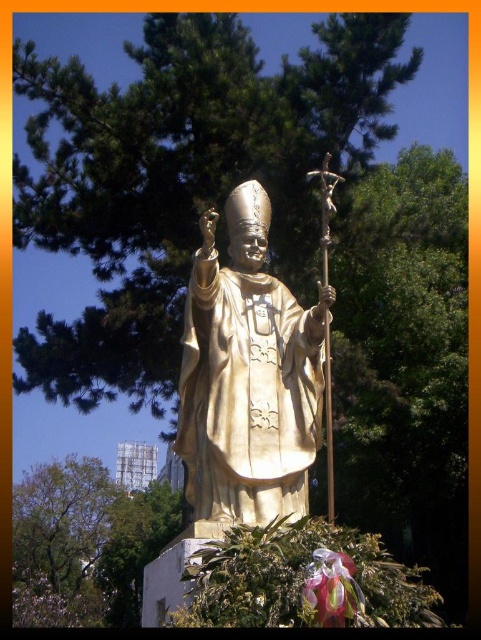
Does gold polished statue at center appear over translucent pink petal at lower center?

Correct, gold polished statue at center is located above translucent pink petal at lower center.

You are a GUI agent. You are given a task and a screenshot of the screen. Output one action in this format:
    pyautogui.click(x=<x>, y=<y>)
    Task: Click on the gold polished statue at center
    The height and width of the screenshot is (640, 481).
    Given the screenshot: What is the action you would take?
    pyautogui.click(x=248, y=376)